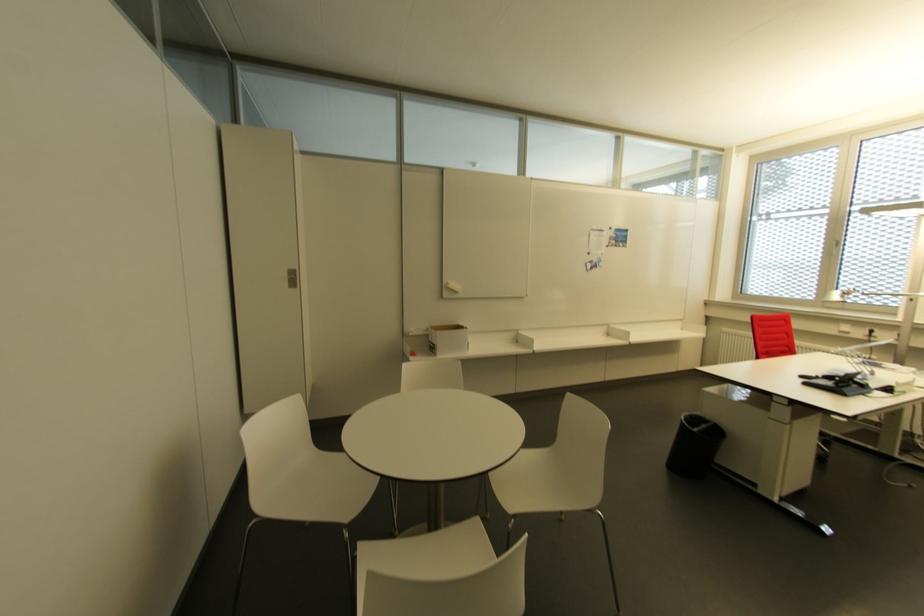
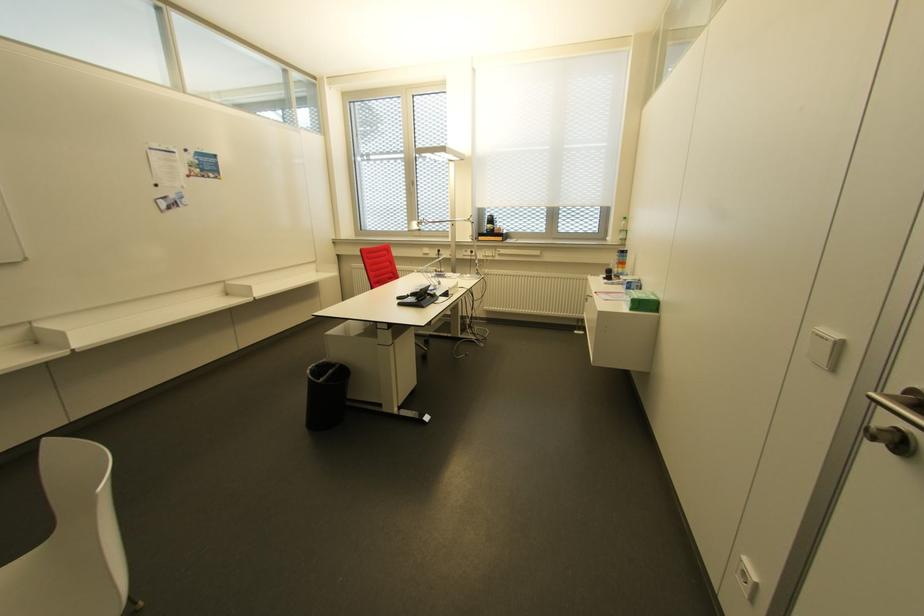
Locate, in the second image, the point that corresponds to point 825,378 in the first image.

(410, 294)